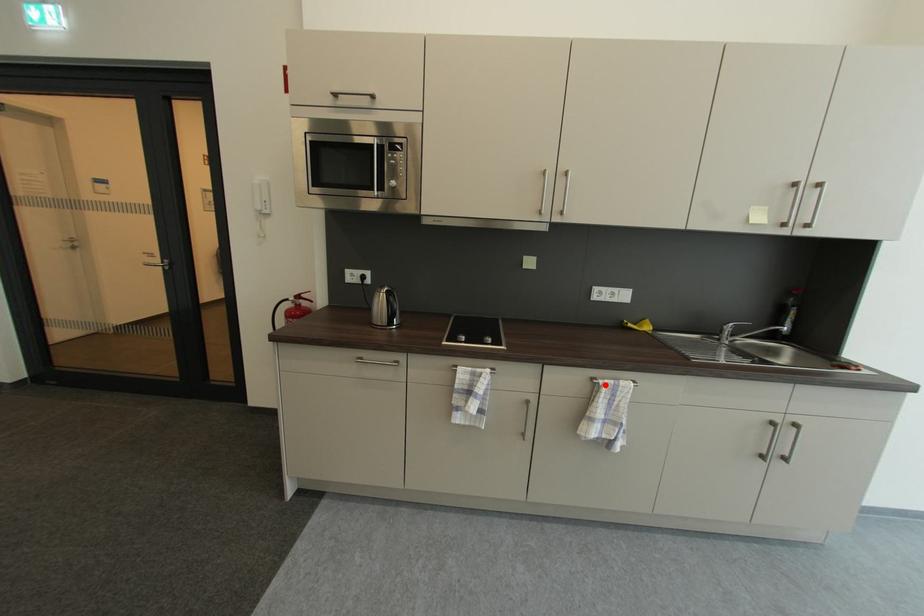
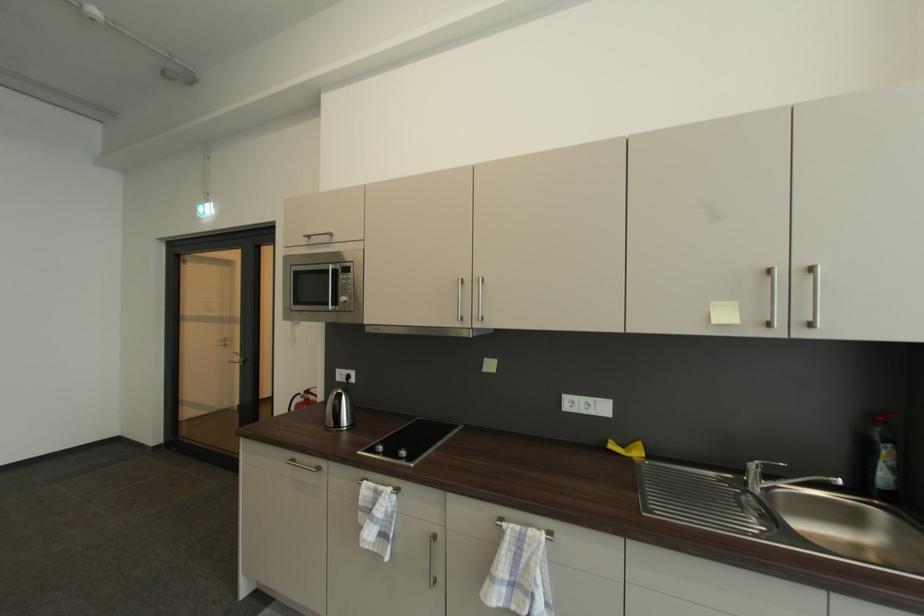
Locate, in the second image, the point that corresponds to the highlighted location in the first image.

(507, 529)